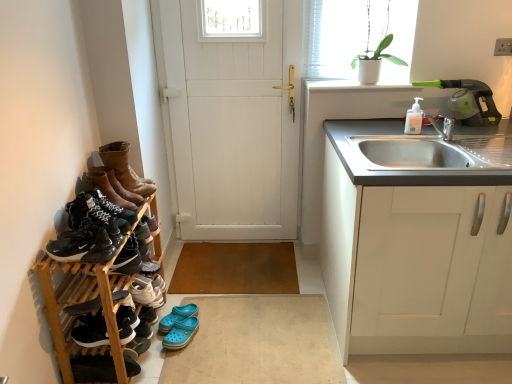
The image size is (512, 384). Find the location of `vacant space to the left of shiny black sneakers at left, which appears as the 4th footwear when viewed from the top`. vacant space to the left of shiny black sneakers at left, which appears as the 4th footwear when viewed from the top is located at coordinates (52, 247).